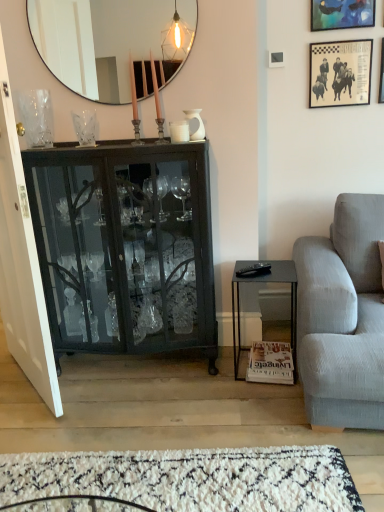
Where is `light gray fabric couch at right`? light gray fabric couch at right is located at coordinates (343, 316).

Measure the distance between metallic silver picture frame at upper right, the first picture frame viewed from the right, and camera.

metallic silver picture frame at upper right, the first picture frame viewed from the right, and camera are 7.28 feet apart.

What do you see at coordinates (179, 131) in the screenshot?
I see `white matte coffee cup at center` at bounding box center [179, 131].

Where is `white glossy vase at upper center, which ranks as the 3th vase in left-to-right order`? white glossy vase at upper center, which ranks as the 3th vase in left-to-right order is located at coordinates (199, 123).

What is the approximate width of black glass cabinet at left?

The width of black glass cabinet at left is 13.91 inches.

At what (x,y) coordinates should I click in order to perform the action: click on matte black mirror at upper center. Please return your answer as a coordinate pair (x, y). The image size is (384, 512). Looking at the image, I should click on (112, 42).

Is white matte door at left directly adjacent to light gray fabric couch at right?

white matte door at left and light gray fabric couch at right are not in contact.

Does point (18, 237) appear closer or farther from the camera than point (339, 298)?

Point (18, 237).

Is white matte door at left inside the boundaries of light gray fabric couch at right, or outside?

white matte door at left is located beyond the bounds of light gray fabric couch at right.

From a real-world perspective, is white matte door at left on top of light gray fabric couch at right?

Yes, from a real-world perspective, white matte door at left is on top of light gray fabric couch at right.

Based on the photo, how many degrees apart are the facing directions of white matte coffee cup at center and white glossy vase at upper center, which ranks as the 3th vase in left-to-right order?

The facing directions of white matte coffee cup at center and white glossy vase at upper center, which ranks as the 3th vase in left-to-right order, are 2.72 degrees apart.

Which object is positioned more to the right, white matte coffee cup at center or white glossy vase at upper center, which ranks as the 3th vase in left-to-right order?

From the viewer's perspective, white glossy vase at upper center, which ranks as the 3th vase in left-to-right order, appears more on the right side.

Considering their positions, is white matte coffee cup at center located in front of or behind white glossy vase at upper center, which ranks as the 3th vase in left-to-right order?

white matte coffee cup at center is positioned closer to the viewer than white glossy vase at upper center, which ranks as the 3th vase in left-to-right order.

Does white matte coffee cup at center have a larger size compared to white glossy vase at upper center, which ranks as the 1th vase in right-to-left order?

Incorrect, white matte coffee cup at center is not larger than white glossy vase at upper center, which ranks as the 1th vase in right-to-left order.

Does light gray fabric couch at right have a lesser width compared to white matte door at left?

In fact, light gray fabric couch at right might be wider than white matte door at left.

Locate an element on the screen. Image resolution: width=384 pixels, height=512 pixels. door on the left of the light gray fabric couch at right is located at coordinates (22, 263).

From the image's perspective, between light gray fabric couch at right and white matte door at left, which one is located above?

white matte door at left.

From the image's perspective, relative to white shag rug at lower center, is light gray fabric couch at right above or below?

From the image's perspective, light gray fabric couch at right appears above white shag rug at lower center.

How different are the orientations of light gray fabric couch at right and white shag rug at lower center in degrees?

There is a 173-degree angle between the facing directions of light gray fabric couch at right and white shag rug at lower center.

Considering the relative sizes of light gray fabric couch at right and white shag rug at lower center in the image provided, is light gray fabric couch at right smaller than white shag rug at lower center?

Incorrect, light gray fabric couch at right is not smaller in size than white shag rug at lower center.

Is point (381, 234) in front of point (225, 480)?

No.

Considering the sizes of objects metallic blue painting at upper right, the first picture frame when ordered from left to right, and matte black mirror at upper center in the image provided, who is thinner, metallic blue painting at upper right, the first picture frame when ordered from left to right, or matte black mirror at upper center?

matte black mirror at upper center is thinner.

From the image's perspective, who appears lower, metallic blue painting at upper right, the first picture frame when ordered from left to right, or matte black mirror at upper center?

matte black mirror at upper center appears lower in the image.

Is metallic blue painting at upper right, acting as the third picture frame starting from the right, not near matte black mirror at upper center?

Indeed, metallic blue painting at upper right, acting as the third picture frame starting from the right, is not near matte black mirror at upper center.

Can you confirm if metallic blue painting at upper right, the first picture frame when ordered from left to right, is smaller than matte black mirror at upper center?

Yes.

Does clear glass vase at upper center, the 2th vase when ordered from right to left, have a smaller size compared to white shag rug at lower center?

Yes.

Considering the relative sizes of clear glass vase at upper center, the 2th vase when ordered from right to left, and white shag rug at lower center in the image provided, is clear glass vase at upper center, the 2th vase when ordered from right to left, wider than white shag rug at lower center?

In fact, clear glass vase at upper center, the 2th vase when ordered from right to left, might be narrower than white shag rug at lower center.

From a real-world perspective, is clear glass vase at upper center, the 2th vase when ordered from right to left, physically located above or below white shag rug at lower center?

clear glass vase at upper center, the 2th vase when ordered from right to left, is above white shag rug at lower center.

Is clear glass vase at upper center, the 2th vase when ordered from right to left, inside or outside of white shag rug at lower center?

clear glass vase at upper center, the 2th vase when ordered from right to left, is not inside white shag rug at lower center, it's outside.

Based on the photo, could you tell me if clear glass vase at upper left, placed as the third vase when sorted from right to left, is facing light gray fabric couch at right?

No, clear glass vase at upper left, placed as the third vase when sorted from right to left, is not turned towards light gray fabric couch at right.

From the picture: Would you say clear glass vase at upper left, which is the 1th vase in left-to-right order, is outside light gray fabric couch at right?

Indeed, clear glass vase at upper left, which is the 1th vase in left-to-right order, is completely outside light gray fabric couch at right.

From the image's perspective, starting from the light gray fabric couch at right, which vase is the 3rd one above? Please provide its 2D coordinates.

[(36, 117)]

Considering their positions, is clear glass vase at upper left, placed as the third vase when sorted from right to left, located in front of or behind light gray fabric couch at right?

clear glass vase at upper left, placed as the third vase when sorted from right to left, is positioned farther from the viewer than light gray fabric couch at right.

At what (x,y) coordinates should I click in order to perform the action: click on door above the light gray fabric couch at right (from the image's perspective). Please return your answer as a coordinate pair (x, y). Looking at the image, I should click on [x=22, y=263].

Image resolution: width=384 pixels, height=512 pixels. I want to click on coffee cup located in front of the white glossy vase at upper center, which ranks as the 1th vase in right-to-left order, so (x=179, y=131).

From the image, which object appears to be farther from black metal side table at lower right, metallic blue painting at upper right, the first picture frame when ordered from left to right, or light gray fabric couch at right?

Based on the image, metallic blue painting at upper right, the first picture frame when ordered from left to right, appears to be further to black metal side table at lower right.

Which object lies nearer to the anchor point black paper picture frame at upper right, which appears as the 2th picture frame when viewed from the right, white matte door at left or black metal side table at lower right?

The object closer to black paper picture frame at upper right, which appears as the 2th picture frame when viewed from the right, is black metal side table at lower right.

Looking at this image, estimate the real-world distances between objects in this image. Which object is further from white shag rug at lower center, black metal side table at lower right or white matte coffee cup at center?

The object further to white shag rug at lower center is white matte coffee cup at center.

Considering their positions, is light gray fabric couch at right positioned further to black paper picture frame at upper right, the 2th picture frame from the left, than clear glass vase at upper left, which is the 1th vase in left-to-right order?

Based on the image, clear glass vase at upper left, which is the 1th vase in left-to-right order, appears to be further to black paper picture frame at upper right, the 2th picture frame from the left.

From the image, which object appears to be nearer to metallic blue painting at upper right, the first picture frame when ordered from left to right, clear glass vase at upper center, acting as the second vase starting from the left, or black paper picture frame at upper right, the 2th picture frame from the left?

black paper picture frame at upper right, the 2th picture frame from the left, lies closer to metallic blue painting at upper right, the first picture frame when ordered from left to right, than the other object.

Based on their spatial positions, is white glossy vase at upper center, which ranks as the 1th vase in right-to-left order, or white shag rug at lower center further from black metal side table at lower right?

The object further to black metal side table at lower right is white glossy vase at upper center, which ranks as the 1th vase in right-to-left order.

Looking at the image, which one is located further to metallic silver picture frame at upper right, the third picture frame viewed from the left, black metal side table at lower right or metallic blue painting at upper right, acting as the third picture frame starting from the right?

The object further to metallic silver picture frame at upper right, the third picture frame viewed from the left, is black metal side table at lower right.

When comparing their distances from clear glass vase at upper center, acting as the second vase starting from the left, does metallic blue painting at upper right, the first picture frame when ordered from left to right, or white matte coffee cup at center seem further?

Among the two, metallic blue painting at upper right, the first picture frame when ordered from left to right, is located further to clear glass vase at upper center, acting as the second vase starting from the left.

Where is `mirror between black paper picture frame at upper right, the 2th picture frame from the left, and light gray fabric couch at right from top to bottom`? The width and height of the screenshot is (384, 512). mirror between black paper picture frame at upper right, the 2th picture frame from the left, and light gray fabric couch at right from top to bottom is located at coordinates (112, 42).

Image resolution: width=384 pixels, height=512 pixels. I want to click on vase between clear glass vase at upper center, the 2th vase when ordered from right to left, and black paper picture frame at upper right, the 2th picture frame from the left, so click(x=199, y=123).

Where is `coffee cup between metallic blue painting at upper right, the first picture frame when ordered from left to right, and black metal side table at lower right from top to bottom`? The width and height of the screenshot is (384, 512). coffee cup between metallic blue painting at upper right, the first picture frame when ordered from left to right, and black metal side table at lower right from top to bottom is located at coordinates (179, 131).

I want to click on desk between white matte door at left and metallic blue painting at upper right, the first picture frame when ordered from left to right, so click(x=266, y=282).